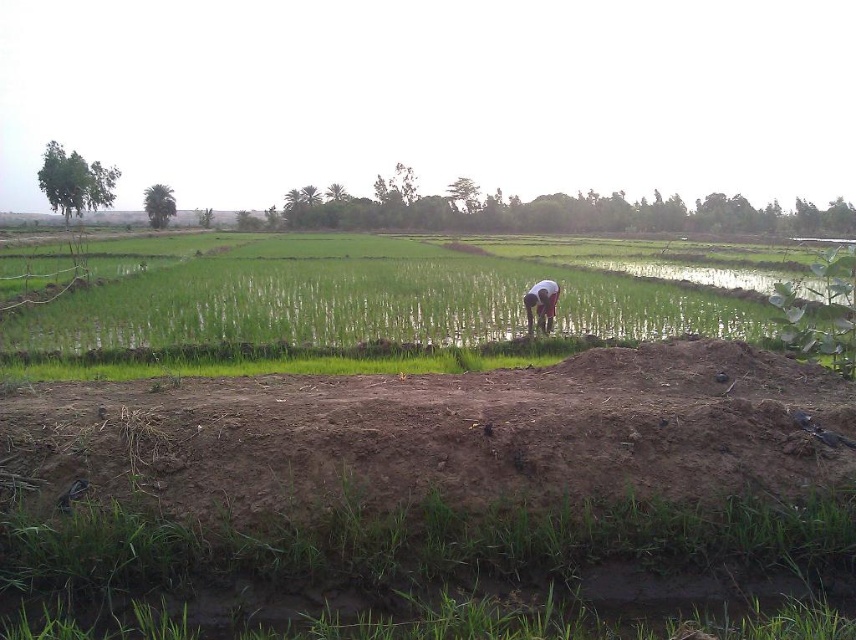
Question: In this image, where is green grass at center located relative to dark brown skin at center?

Choices:
 (A) left
 (B) right

Answer: (A)

Question: Is green grass at center bigger than dark brown skin at center?

Choices:
 (A) no
 (B) yes

Answer: (B)

Question: Is green grass at center bigger than dark brown skin at center?

Choices:
 (A) yes
 (B) no

Answer: (A)

Question: Which of the following is the closest to the observer?

Choices:
 (A) (468, 326)
 (B) (524, 305)

Answer: (B)